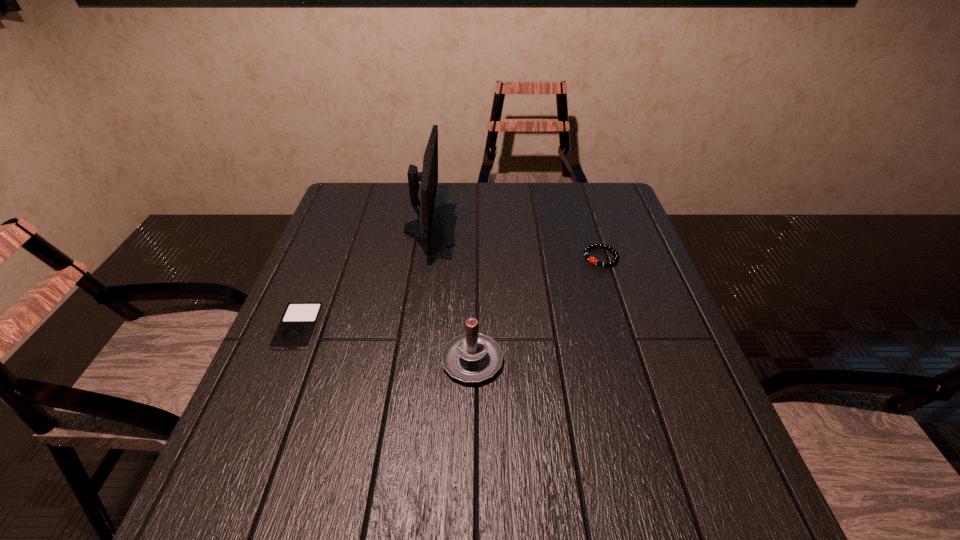
Where is `vacant region between the candle and the leftmost object`? vacant region between the candle and the leftmost object is located at coordinates (386, 343).

At what (x,y) coordinates should I click in order to perform the action: click on vacant area that lies between the rightmost object and the tallest object. Please return your answer as a coordinate pair (x, y). The width and height of the screenshot is (960, 540). Looking at the image, I should click on (516, 244).

Where is `free space between the tallest object and the second tallest object`? The width and height of the screenshot is (960, 540). free space between the tallest object and the second tallest object is located at coordinates (451, 294).

You are a GUI agent. You are given a task and a screenshot of the screen. Output one action in this format:
    pyautogui.click(x=<x>, y=<y>)
    Task: Click on the vacant point located between the rightmost object and the monitor
    
    Given the screenshot: What is the action you would take?
    pyautogui.click(x=516, y=244)

This screenshot has width=960, height=540. In order to click on free space that is in between the candle and the shortest object in this screenshot , I will do `click(386, 343)`.

Find the location of a particular element. empty space that is in between the second shortest object and the candle is located at coordinates (537, 308).

Locate an element on the screen. The width and height of the screenshot is (960, 540). free area in between the candle and the tallest object is located at coordinates (451, 294).

The height and width of the screenshot is (540, 960). In order to click on vacant space that is in between the shortest object and the third tallest object in this screenshot , I will do `click(450, 292)`.

The height and width of the screenshot is (540, 960). Identify the location of vacant space that's between the shortest object and the candle. (386, 343).

The width and height of the screenshot is (960, 540). What are the coordinates of `unoccupied position between the leftmost object and the monitor` in the screenshot? It's located at (365, 279).